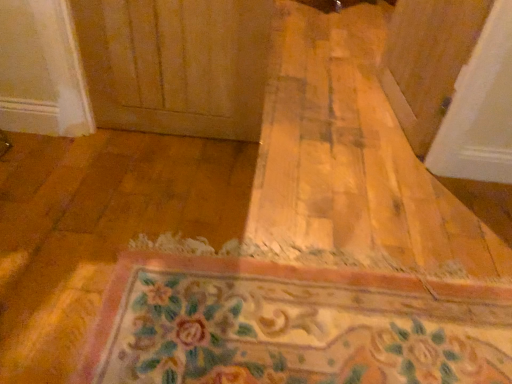
Question: Considering their positions, is transparent plastic screen door at upper right located in front of or behind floral carpet at center?

Choices:
 (A) front
 (B) behind

Answer: (B)

Question: Would you say transparent plastic screen door at upper right is inside or outside floral carpet at center?

Choices:
 (A) outside
 (B) inside

Answer: (A)

Question: From the image's perspective, is transparent plastic screen door at upper right located above or below floral carpet at center?

Choices:
 (A) above
 (B) below

Answer: (A)

Question: From a real-world perspective, relative to transparent plastic screen door at upper right, is floral carpet at center vertically above or below?

Choices:
 (A) below
 (B) above

Answer: (A)

Question: From the image's perspective, is floral carpet at center positioned above or below transparent plastic screen door at upper right?

Choices:
 (A) below
 (B) above

Answer: (A)

Question: Which is correct: floral carpet at center is inside transparent plastic screen door at upper right, or outside of it?

Choices:
 (A) outside
 (B) inside

Answer: (A)

Question: Based on their sizes in the image, would you say floral carpet at center is bigger or smaller than transparent plastic screen door at upper right?

Choices:
 (A) big
 (B) small

Answer: (B)